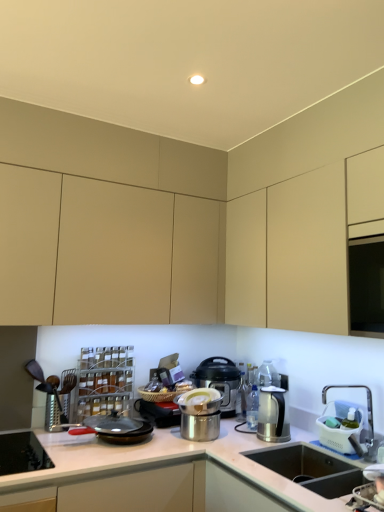
Question: Could you tell me if satin silver kettle at right, which is the 2th kitchen appliance in front-to-back order, is facing brushed metal grater at left?

Choices:
 (A) no
 (B) yes

Answer: (A)

Question: Is satin silver kettle at right, which is the 2th kitchen appliance in front-to-back order, not within brushed metal grater at left?

Choices:
 (A) yes
 (B) no

Answer: (A)

Question: Can you confirm if satin silver kettle at right, marked as the 2th kitchen appliance in a back-to-front arrangement, is bigger than brushed metal grater at left?

Choices:
 (A) no
 (B) yes

Answer: (A)

Question: From a real-world perspective, is satin silver kettle at right, marked as the 2th kitchen appliance in a back-to-front arrangement, under brushed metal grater at left?

Choices:
 (A) no
 (B) yes

Answer: (B)

Question: Considering the relative sizes of satin silver kettle at right, which is the 2th kitchen appliance in front-to-back order, and brushed metal grater at left in the image provided, is satin silver kettle at right, which is the 2th kitchen appliance in front-to-back order, smaller than brushed metal grater at left?

Choices:
 (A) yes
 (B) no

Answer: (A)

Question: Would you say matte black pressure cooker at center, arranged as the first kitchen appliance when viewed from the back, is to the left or to the right of satin silver kettle at right, marked as the 2th kitchen appliance in a back-to-front arrangement, in the picture?

Choices:
 (A) right
 (B) left

Answer: (B)

Question: Considering their positions, is matte black pressure cooker at center, arranged as the first kitchen appliance when viewed from the back, located in front of or behind satin silver kettle at right, marked as the 2th kitchen appliance in a back-to-front arrangement?

Choices:
 (A) front
 (B) behind

Answer: (B)

Question: In terms of height, does matte black pressure cooker at center, which is counted as the 3th kitchen appliance, starting from the front, look taller or shorter compared to satin silver kettle at right, marked as the 2th kitchen appliance in a back-to-front arrangement?

Choices:
 (A) tall
 (B) short

Answer: (A)

Question: Is point (208, 385) positioned closer to the camera than point (266, 393)?

Choices:
 (A) closer
 (B) farther

Answer: (B)

Question: From a real-world perspective, is matte black pressure cooker at center, arranged as the first kitchen appliance when viewed from the back, positioned above or below brushed metal stove at lower left?

Choices:
 (A) below
 (B) above

Answer: (B)

Question: Is point (226, 358) closer or farther from the camera than point (11, 462)?

Choices:
 (A) farther
 (B) closer

Answer: (A)

Question: In the image, is matte black pressure cooker at center, arranged as the first kitchen appliance when viewed from the back, on the left side or the right side of brushed metal stove at lower left?

Choices:
 (A) right
 (B) left

Answer: (A)

Question: From the image's perspective, is matte black pressure cooker at center, arranged as the first kitchen appliance when viewed from the back, located above or below brushed metal stove at lower left?

Choices:
 (A) below
 (B) above

Answer: (B)

Question: Which is correct: white glossy countertop at center is inside satin silver kettle at right, which is the 2th kitchen appliance in front-to-back order, or outside of it?

Choices:
 (A) inside
 (B) outside

Answer: (B)

Question: Based on their positions, is white glossy countertop at center located to the left or right of satin silver kettle at right, which is the 2th kitchen appliance in front-to-back order?

Choices:
 (A) left
 (B) right

Answer: (A)